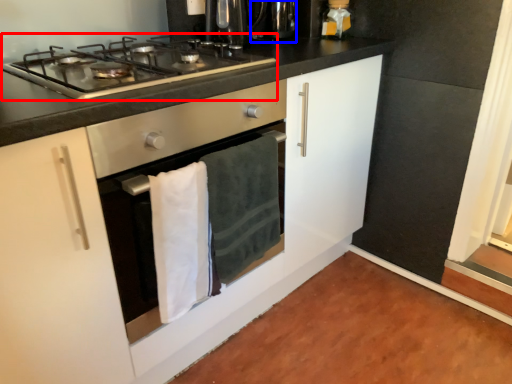
Question: Which of the following is the farthest to the observer, gas stove (highlighted by a red box) or appliance (highlighted by a blue box)?

Choices:
 (A) gas stove
 (B) appliance

Answer: (B)